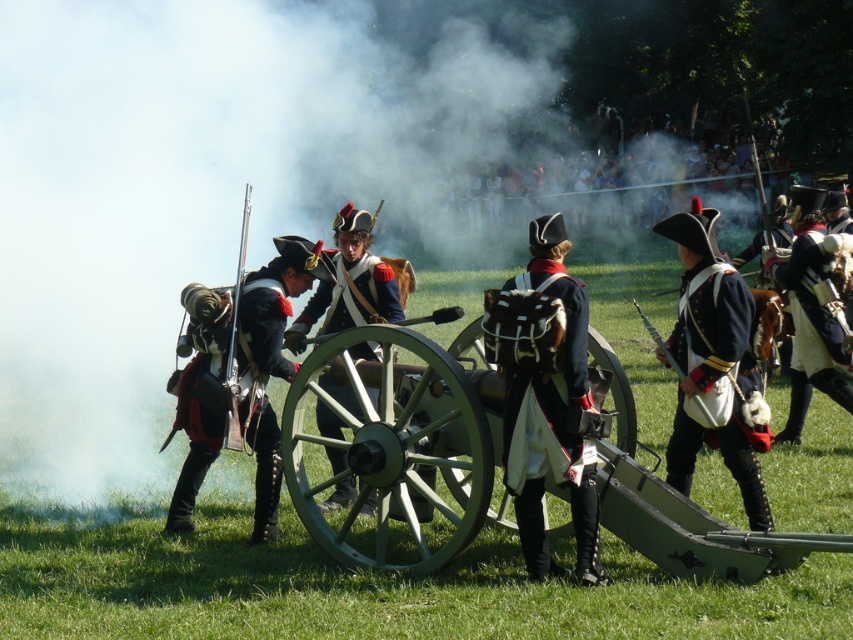
You are a historian examining the historical reenactment scene. You need to determine the position of the green polished wood cannon at center relative to the soldiers. Based on the coordinates provided, is the cannon positioned more towards the front or the back of the soldiers?

The green polished wood cannon at center is located at point coordinates, which places it more towards the back of the soldiers since the y coordinate is 0.469, indicating it is positioned further back in the scene.

You are a costume designer examining the historical reenactment scene. You need to determine which garment has a wider silhouette between the matte blue coat at center and the dark blue fabric uniform at center. Which one is wider?

The matte blue coat at center has a larger width compared to the dark blue fabric uniform at center, making it the wider garment between the two.

You are a photographer positioned in front of the historical reenactment group. You want to capture a closeup of the matte blue coat at center without the dark blue fabric uniform at center overlapping it. Based on their positions, is this possible?

Yes, the matte blue coat at center is closer to the viewer than the dark blue fabric uniform at center, so you can focus on the matte blue coat at center without the dark blue fabric uniform at center overlapping it.